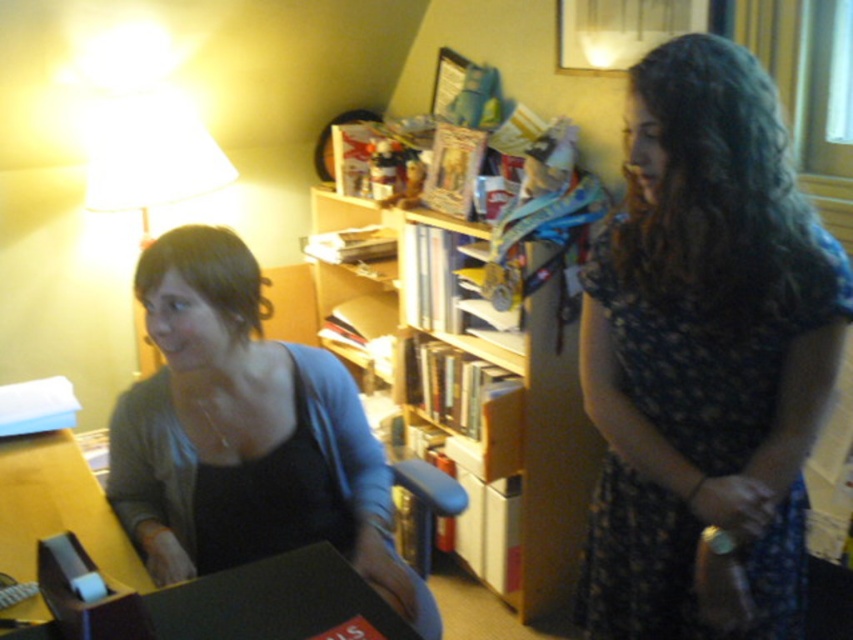
Which is in front, point (141, 556) or point (395, 304)?

Positioned in front is point (141, 556).

Can you confirm if matte black shirt at left is positioned below wooden bookshelf at center?

Correct, matte black shirt at left is located below wooden bookshelf at center.

Which is behind, point (308, 520) or point (491, 563)?

The point (491, 563) is more distant.

You are a GUI agent. You are given a task and a screenshot of the screen. Output one action in this format:
    pyautogui.click(x=<x>, y=<y>)
    Task: Click on the matte black shirt at left
    
    Given the screenshot: What is the action you would take?
    pyautogui.click(x=245, y=435)

Who is more forward, (670, 362) or (164, 518)?

Positioned in front is point (670, 362).

Between dark floral dress at right and matte black shirt at left, which one is positioned lower?

Positioned lower is matte black shirt at left.

Image resolution: width=853 pixels, height=640 pixels. What do you see at coordinates (705, 356) in the screenshot?
I see `dark floral dress at right` at bounding box center [705, 356].

You are a GUI agent. You are given a task and a screenshot of the screen. Output one action in this format:
    pyautogui.click(x=<x>, y=<y>)
    Task: Click on the dark floral dress at right
    The height and width of the screenshot is (640, 853).
    Given the screenshot: What is the action you would take?
    pyautogui.click(x=705, y=356)

Who is lower down, dark floral dress at right or wooden bookshelf at center?

dark floral dress at right is below.

Is dark floral dress at right closer to camera compared to wooden bookshelf at center?

That is True.

Who is more forward, (767, 294) or (492, 392)?

Point (767, 294) is more forward.

Image resolution: width=853 pixels, height=640 pixels. I want to click on dark floral dress at right, so (705, 356).